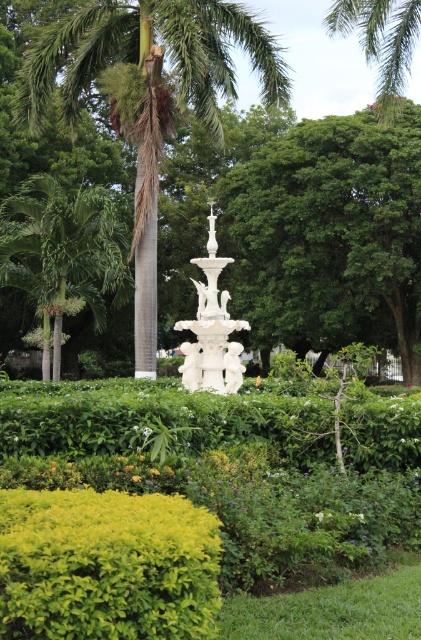
You are standing in the garden and want to take a photo of the white marble fountain at center and the green leafy palm tree at center. Which object should you position to your right side to include both in the frame?

To include both the white marble fountain at center and the green leafy palm tree at center in your photo, position the white marble fountain at center to your right side since the green leafy palm tree at center is located to the left of it.

Based on the photo, you are standing in the garden and want to water the green leafy palm at left. You have a garden hose that can reach 30 meters. Can you water it without moving closer?

The green leafy palm at left is 33.65 meters away from the viewer, which is beyond the 30 meter reach of the garden hose. You will need to move closer to water it.